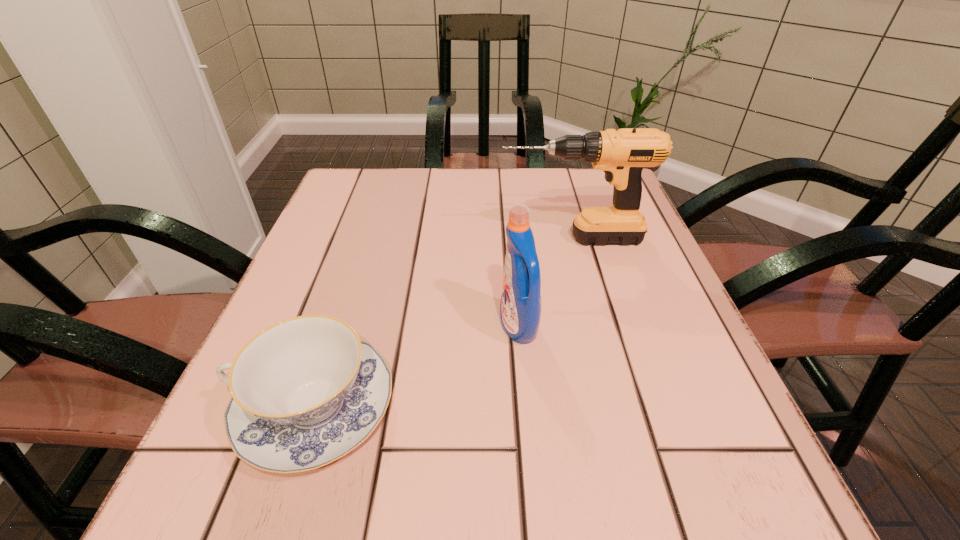
You are a GUI agent. You are given a task and a screenshot of the screen. Output one action in this format:
    pyautogui.click(x=<x>, y=<y>)
    Task: Click on the farthest object
    This screenshot has width=960, height=540.
    Given the screenshot: What is the action you would take?
    pyautogui.click(x=622, y=155)

You are a GUI agent. You are given a task and a screenshot of the screen. Output one action in this format:
    pyautogui.click(x=<x>, y=<y>)
    Task: Click on the detergent
    
    Given the screenshot: What is the action you would take?
    (520, 308)

Find the location of a particular element. This screenshot has width=960, height=540. the shortest object is located at coordinates (306, 391).

Where is `the leftmost object`? This screenshot has width=960, height=540. the leftmost object is located at coordinates (306, 391).

Locate an element on the screen. free space located at the tip of the farthest object is located at coordinates (359, 239).

Locate an element on the screen. This screenshot has width=960, height=540. vacant space located at the tip of the farthest object is located at coordinates (447, 239).

I want to click on vacant space located 0.380m at the tip of the farthest object, so click(322, 239).

Where is `vacant space situated 0.380m on the label of the detergent`? This screenshot has width=960, height=540. vacant space situated 0.380m on the label of the detergent is located at coordinates (278, 326).

The image size is (960, 540). Identify the location of free spot located on the label of the detergent. (377, 326).

Image resolution: width=960 pixels, height=540 pixels. I want to click on blank area located on the label of the detergent, so click(372, 326).